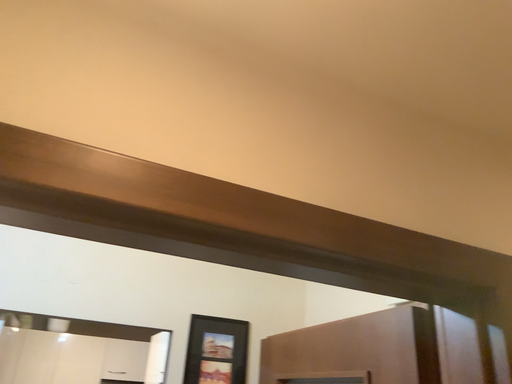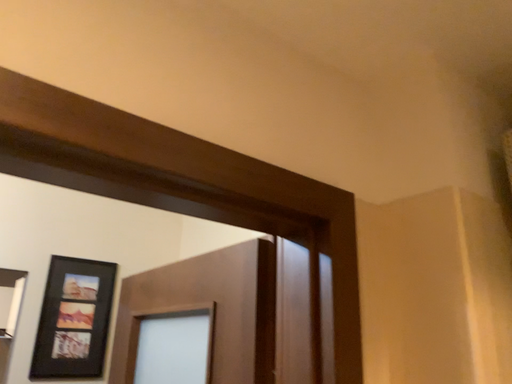
Question: How did the camera likely rotate when shooting the video?

Choices:
 (A) rotated upward
 (B) rotated downward

Answer: (B)